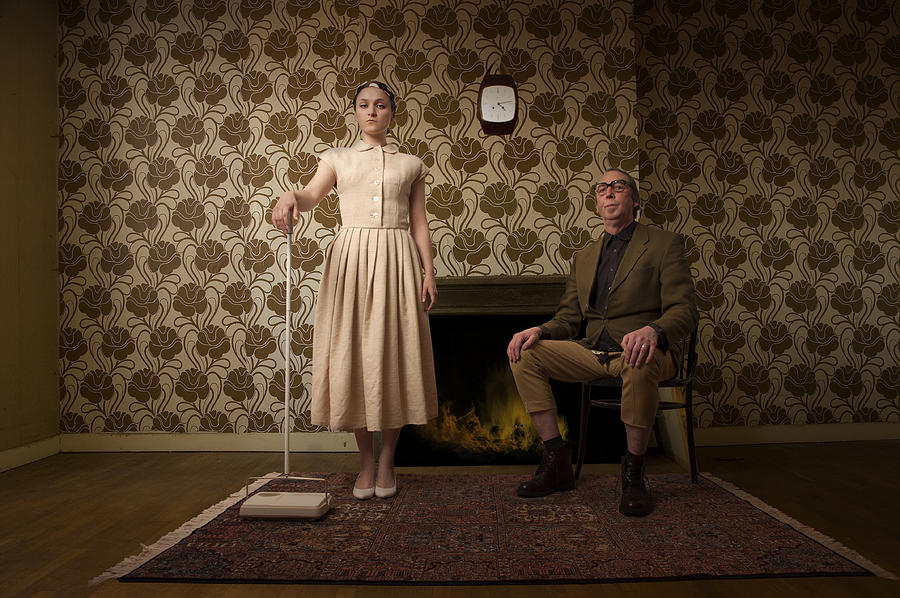
Locate an element on the screen. The image size is (900, 598). beige and brown wall with rose like designs is located at coordinates point(732,170), point(263,158).